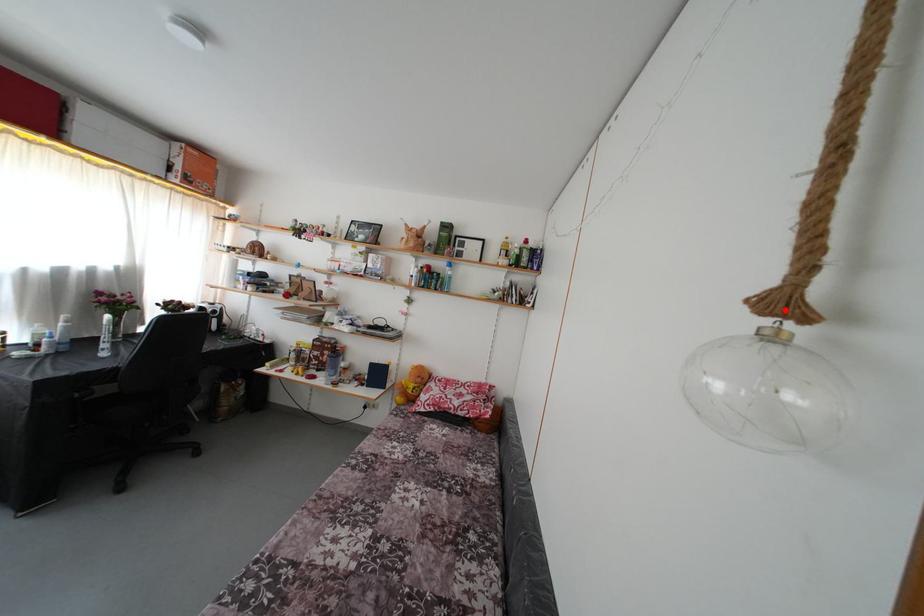
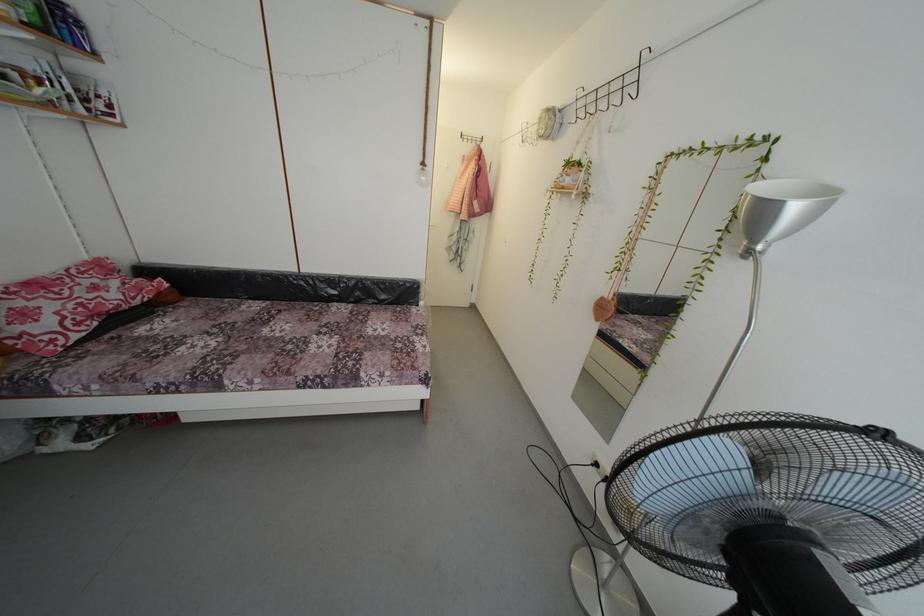
The point at the highlighted location is marked in the first image. Where is the corresponding point in the second image?

(429, 169)